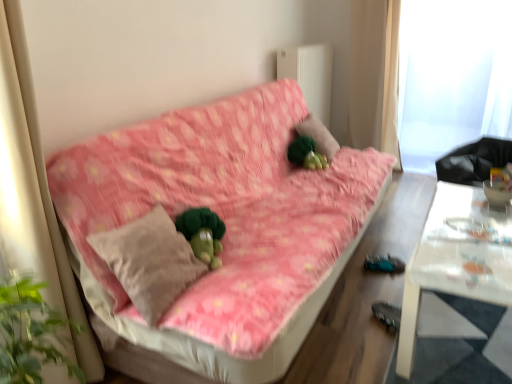
What are the coordinates of `vacant space positioned to the left of white glossy table at right` in the screenshot? It's located at (355, 327).